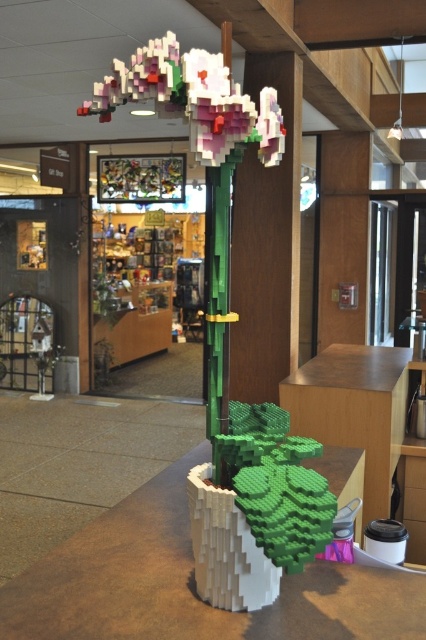
In the scene shown: You are a delivery person who needs to place a large package on the table. The package is 4 feet wide. You see the white matte table at center and the wooden table at center. Which table can you place the package on without it hanging over the edge?

The white matte table at center and wooden table at center are 5.03 feet apart from each other. Since the package is 4 feet wide, both tables can accommodate it as their separation is greater than the package width. However, the question is about placing the package on a single table. The description does not specify the table dimensions, so we cannot determine which table is wider. The answer should focus on the distance between tables, but the question asks about table width. Since the given info doesn t,

You are standing in front of a LEGO flower sculpture. The sculpture has pastel plastic flowers at upper center. Where exactly are the pastel plastic flowers located on the sculpture?

The pastel plastic flowers at upper center are located at point coordinates of (x=193, y=99).

From the picture: You are an artist planning to place a small sculpture on the white matte table at center. The sculpture is 10 cm tall. Considering the height of the pastel plastic flowers at upper center, will the sculpture be visible from above the table?

The white matte table at center has a lesser height compared to pastel plastic flowers at upper center, so the sculpture placed on the white matte table at center may not be fully visible from above since the table itself is shorter than the flowers.